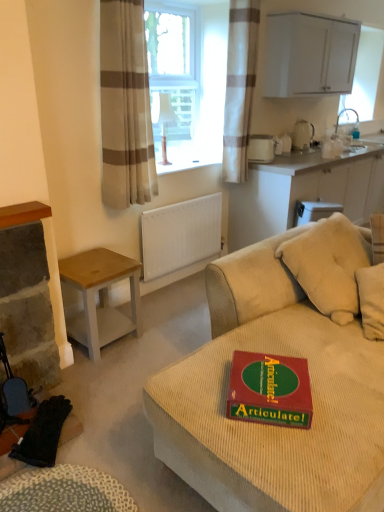
Question: Is silver metallic faucet at upper right positioned with its back to white glossy cabinet at upper right, which is the second cabinetry from bottom to top?

Choices:
 (A) no
 (B) yes

Answer: (A)

Question: Are silver metallic faucet at upper right and white glossy cabinet at upper right, arranged as the first cabinetry when viewed from the top, far apart?

Choices:
 (A) no
 (B) yes

Answer: (A)

Question: Can you confirm if silver metallic faucet at upper right is taller than white glossy cabinet at upper right, which is the second cabinetry from bottom to top?

Choices:
 (A) yes
 (B) no

Answer: (B)

Question: Can you confirm if silver metallic faucet at upper right is positioned to the right of white glossy cabinet at upper right, arranged as the first cabinetry when viewed from the top?

Choices:
 (A) no
 (B) yes

Answer: (B)

Question: Does silver metallic faucet at upper right have a lesser height compared to white glossy cabinet at upper right, which is the second cabinetry from bottom to top?

Choices:
 (A) yes
 (B) no

Answer: (A)

Question: From a real-world perspective, relative to white matte cabinet at upper right, the first cabinetry when ordered from bottom to top, is green cardboard game at center vertically above or below?

Choices:
 (A) above
 (B) below

Answer: (A)

Question: Is green cardboard game at center to the left or to the right of white matte cabinet at upper right, which ranks as the 2th cabinetry in top-to-bottom order, in the image?

Choices:
 (A) right
 (B) left

Answer: (B)

Question: Relative to white matte cabinet at upper right, which ranks as the 2th cabinetry in top-to-bottom order, is green cardboard game at center in front or behind?

Choices:
 (A) behind
 (B) front

Answer: (B)

Question: Based on their sizes in the image, would you say green cardboard game at center is bigger or smaller than white matte cabinet at upper right, the first cabinetry when ordered from bottom to top?

Choices:
 (A) big
 (B) small

Answer: (B)

Question: Considering their positions, is silver metallic faucet at upper right located in front of or behind white plastic container at upper center, placed as the first appliance when sorted from left to right?

Choices:
 (A) front
 (B) behind

Answer: (B)

Question: Considering the positions of silver metallic faucet at upper right and white plastic container at upper center, placed as the first appliance when sorted from left to right, in the image, is silver metallic faucet at upper right wider or thinner than white plastic container at upper center, placed as the first appliance when sorted from left to right,?

Choices:
 (A) thin
 (B) wide

Answer: (A)

Question: From the image's perspective, relative to white plastic container at upper center, which is counted as the 1th appliance, starting from the front, is silver metallic faucet at upper right above or below?

Choices:
 (A) above
 (B) below

Answer: (A)

Question: From a real-world perspective, is silver metallic faucet at upper right above or below white plastic container at upper center, marked as the second appliance in a right-to-left arrangement?

Choices:
 (A) above
 (B) below

Answer: (A)

Question: From a real-world perspective, is matte white lampshade at center physically located above or below silver metallic faucet at upper right?

Choices:
 (A) above
 (B) below

Answer: (A)

Question: Does point (170, 115) appear closer or farther from the camera than point (336, 123)?

Choices:
 (A) farther
 (B) closer

Answer: (B)